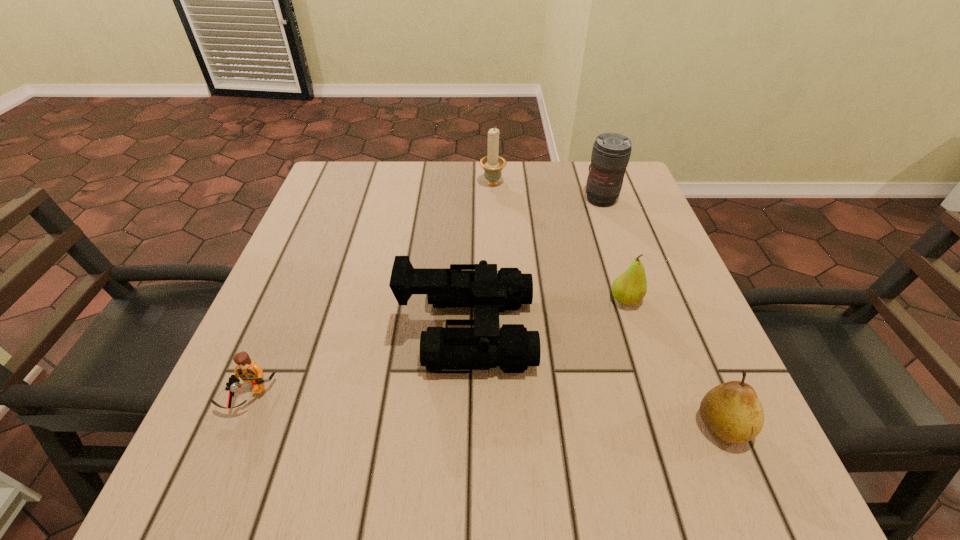
Where is `telephoto lens`? The height and width of the screenshot is (540, 960). telephoto lens is located at coordinates (611, 152).

This screenshot has height=540, width=960. In order to click on candle_holder in this screenshot , I will do [492, 164].

This screenshot has height=540, width=960. Identify the location of binoculars. (487, 345).

I want to click on the left pear, so click(630, 287).

The image size is (960, 540). Identify the location of the nearer pear. (732, 411).

Locate an element on the screen. Lego is located at coordinates (247, 370).

The width and height of the screenshot is (960, 540). I want to click on the shortest object, so click(247, 370).

You are a GUI agent. You are given a task and a screenshot of the screen. Output one action in this format:
    pyautogui.click(x=<x>, y=<y>)
    Task: Click on the free spot located 0.300m on the side of the telephoto lens where the control switches are located
    
    Given the screenshot: What is the action you would take?
    pyautogui.click(x=635, y=297)

You are a GUI agent. You are given a task and a screenshot of the screen. Output one action in this format:
    pyautogui.click(x=<x>, y=<y>)
    Task: Click on the free point located on the front lenses of the binoculars
    Image resolution: width=960 pixels, height=540 pixels.
    Given the screenshot: What is the action you would take?
    pyautogui.click(x=651, y=330)

Image resolution: width=960 pixels, height=540 pixels. I want to click on vacant space located on the back of the left pear, so (612, 253).